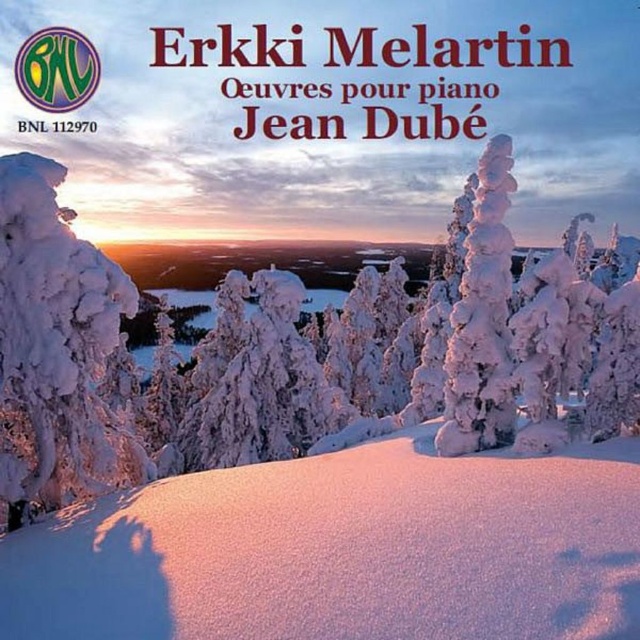
You are an observer standing at the top of the slope looking down. Which object is closer to you, the white fluffy snow at center or the white frosty tree at left?

The white fluffy snow at center is located below the white frosty tree at left, so the white frosty tree at left is closer to you.

You are an observer standing at the bottom of the hill and looking up. Which object, the white fluffy snow at center or the white frosty tree at left, appears closer to you?

The white fluffy snow at center appears closer because it is taller than the white frosty tree at left, making it seem nearer in the visual perspective.